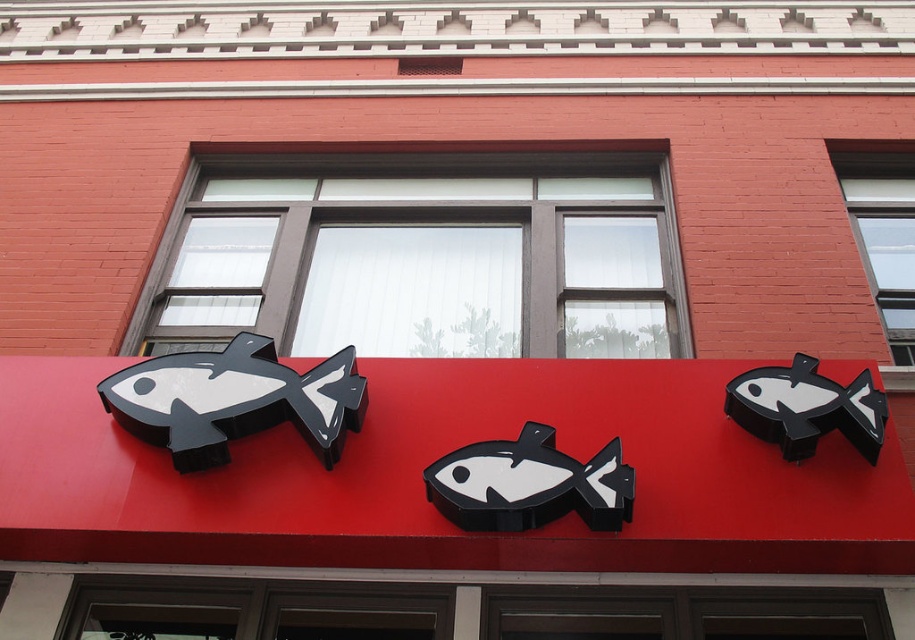
You are an art student analyzing the facade of a building with a red brick exterior. You notice two black matte fish sculptures on the facade. The first is labeled as the matte black fish at center, and the second is labeled as the black matte fish at center. Which of these two fish sculptures is larger?

The matte black fish at center is larger in size than the black matte fish at center.

You are standing in front of the building and want to take a photo of the point at coordinates point (264, 387). The camera you are using has a minimum focus distance of 4 meters. Will the camera be able to focus on the point?

The distance between point (264, 387) and the camera is 4.11 meters, which is greater than the camera minimum focus distance of 4 meters. Therefore, the camera can focus on the point.